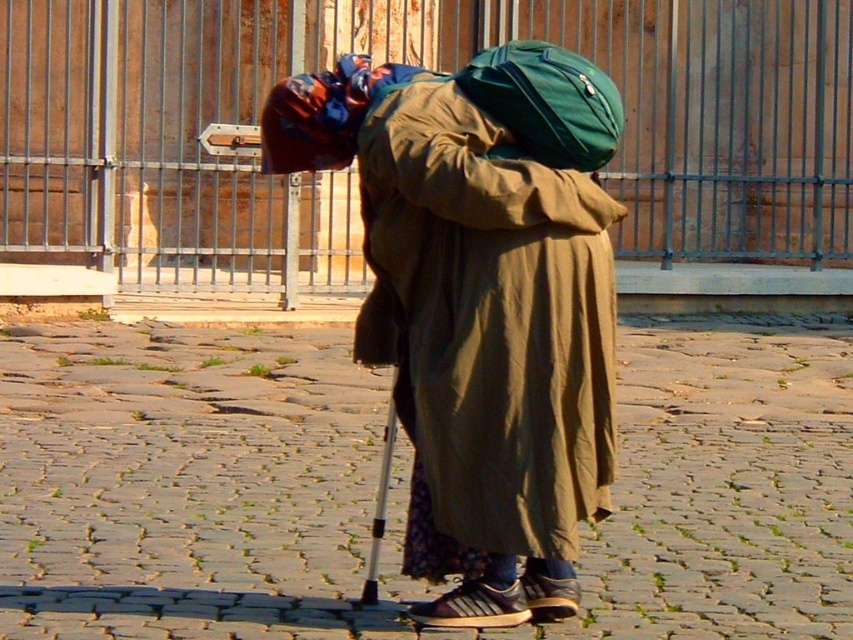
Does brown cobblestone at center appear on the left side of matte olive-green robe at center?

Indeed, brown cobblestone at center is positioned on the left side of matte olive-green robe at center.

Based on the photo, measure the distance between brown cobblestone at center and camera.

7.34 meters

Identify the location of brown cobblestone at center. This screenshot has height=640, width=853. [405, 486].

Which of these two, brown cobblestone at center or green fabric backpack at center, stands shorter?

green fabric backpack at center

Find the location of a particular element. The height and width of the screenshot is (640, 853). brown cobblestone at center is located at coordinates (405, 486).

Image resolution: width=853 pixels, height=640 pixels. In order to click on brown cobblestone at center in this screenshot , I will do `click(405, 486)`.

Which is more to the right, matte olive-green robe at center or green fabric backpack at center?

green fabric backpack at center

Which is behind, point (461, 104) or point (463, 83)?

The point (463, 83) is more distant.

The height and width of the screenshot is (640, 853). I want to click on matte olive-green robe at center, so click(486, 328).